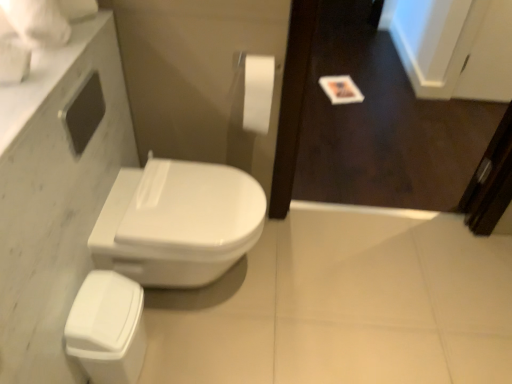
Question: Would you say wooden screen door at upper right is inside or outside white marble countertop at upper left?

Choices:
 (A) inside
 (B) outside

Answer: (B)

Question: Considering the relative positions of wooden screen door at upper right and white marble countertop at upper left in the image provided, is wooden screen door at upper right to the left or to the right of white marble countertop at upper left?

Choices:
 (A) right
 (B) left

Answer: (A)

Question: Estimate the real-world distances between objects in this image. Which object is closer to the white glossy porcelain at lower left?

Choices:
 (A) white marble countertop at upper left
 (B) white glossy bidet at center
 (C) wooden screen door at upper right
 (D) white matte toilet paper at upper center

Answer: (B)

Question: Which is nearer to the white glossy bidet at center?

Choices:
 (A) wooden screen door at upper right
 (B) white marble countertop at upper left
 (C) white matte toilet paper at upper center
 (D) white glossy porcelain at lower left

Answer: (D)